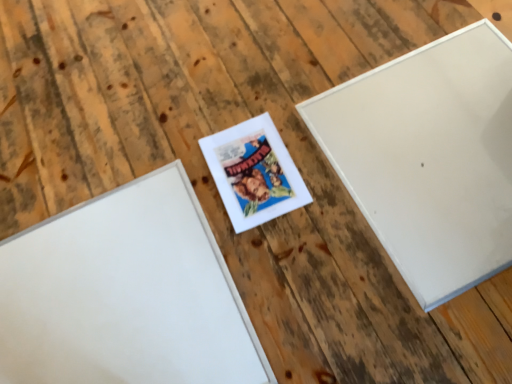
This screenshot has height=384, width=512. What are the coordinates of `free region on the left part of white matte picture frame at upper right, placed as the third picture frame when sorted from left to right` in the screenshot? It's located at (266, 190).